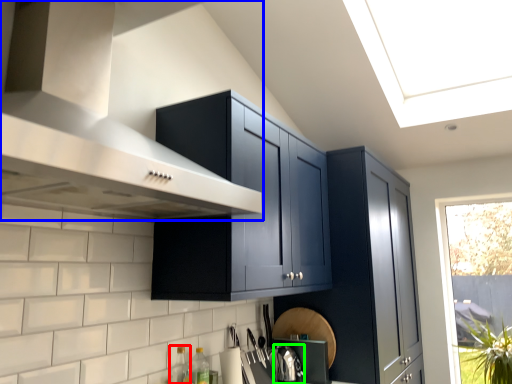
Question: Which object is the closest to the bottle (highlighted by a red box)? Choose among these: vent (highlighted by a blue box) or appliance (highlighted by a green box).

Choices:
 (A) vent
 (B) appliance

Answer: (B)